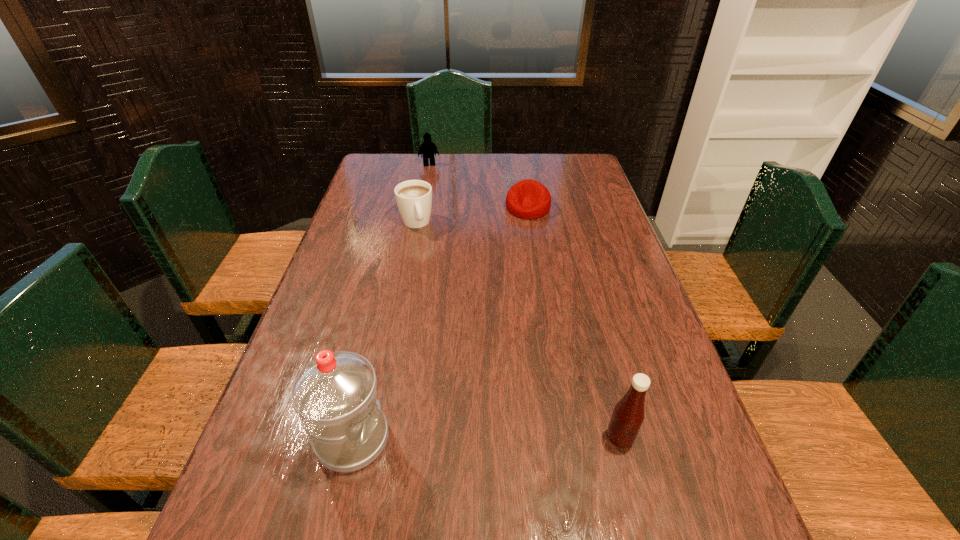
I want to click on vacant space located 0.390m on the face of the Lego, so click(443, 219).

The height and width of the screenshot is (540, 960). Identify the location of vacant position located on the face of the Lego. (435, 183).

At what (x,y) coordinates should I click in order to perform the action: click on vacant space situated with the handle on the side of the cappuccino. Please return your answer as a coordinate pair (x, y). Looking at the image, I should click on (429, 262).

The height and width of the screenshot is (540, 960). Find the location of `free space located 0.220m with the handle on the side of the cappuccino`. free space located 0.220m with the handle on the side of the cappuccino is located at coordinates (435, 279).

I want to click on free region located 0.330m with the handle on the side of the cappuccino, so click(444, 304).

Identify the location of free space located 0.360m on the seat area of the shortest object. point(519,291).

Image resolution: width=960 pixels, height=540 pixels. In order to click on vacant region located on the seat area of the shortest object in this screenshot , I will do `click(525, 235)`.

Locate an element on the screen. The height and width of the screenshot is (540, 960). vacant space located on the seat area of the shortest object is located at coordinates click(519, 291).

Image resolution: width=960 pixels, height=540 pixels. In order to click on object present at the far edge in this screenshot , I will do `click(428, 148)`.

The height and width of the screenshot is (540, 960). I want to click on object situated at the near edge, so click(335, 396).